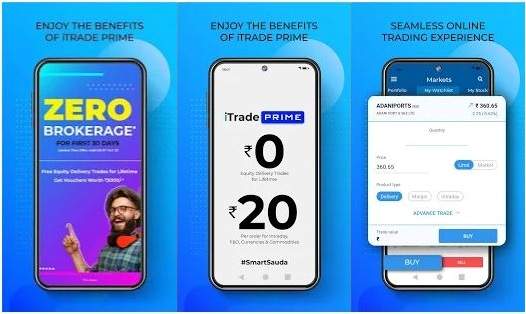
This screenshot has height=314, width=526. Find the location of `frame`. frame is located at coordinates (138, 64).